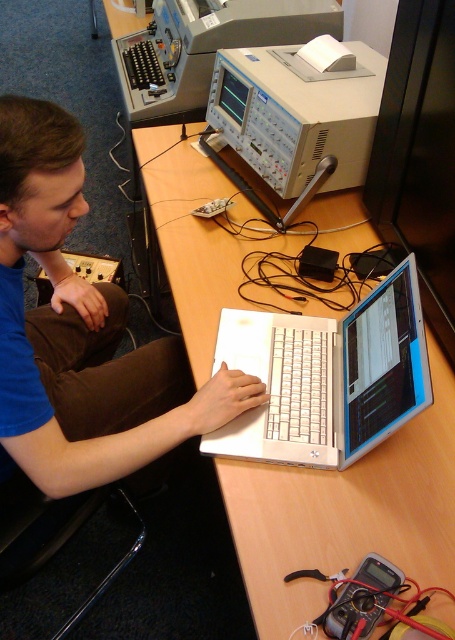
Between point (203, 278) and point (152, 120), which one is positioned behind?

The point (152, 120) is behind.

Does point (229, 497) come behind point (279, 3)?

No, it is not.

Where is `wooden table at center`? The width and height of the screenshot is (455, 640). wooden table at center is located at coordinates (347, 513).

Based on the photo, does gray plastic oscilloscope at upper center lie in front of brown corduroy pants at lower left?

No, it is not.

Find the location of a particular element. The width and height of the screenshot is (455, 640). gray plastic oscilloscope at upper center is located at coordinates (206, 49).

I want to click on gray plastic oscilloscope at upper center, so click(206, 49).

Does wooden table at center have a greater height compared to blue fabric shirt at left?

Correct, wooden table at center is much taller as blue fabric shirt at left.

Where is `wooden table at center`? The image size is (455, 640). wooden table at center is located at coordinates (347, 513).

Based on the photo, measure the distance between wooden table at center and camera.

A distance of 32.16 inches exists between wooden table at center and camera.

The width and height of the screenshot is (455, 640). Identify the location of wooden table at center. (347, 513).